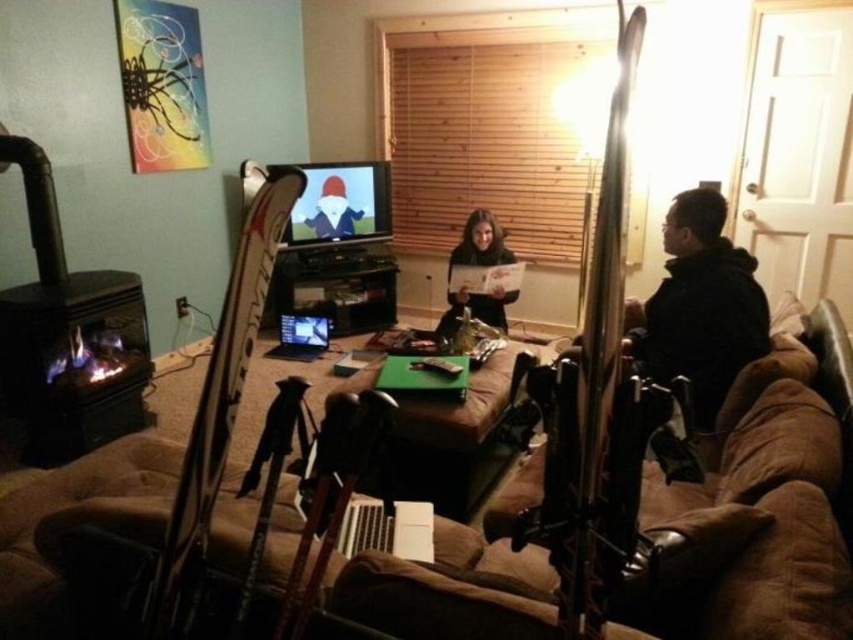
Who is lower down, brown fabric couch at center or dark brown hair at center?

brown fabric couch at center is below.

Can you confirm if brown fabric couch at center is positioned to the right of dark brown hair at center?

Indeed, brown fabric couch at center is positioned on the right side of dark brown hair at center.

The height and width of the screenshot is (640, 853). What do you see at coordinates (750, 522) in the screenshot?
I see `brown fabric couch at center` at bounding box center [750, 522].

At what (x,y) coordinates should I click in order to perform the action: click on brown fabric couch at center. Please return your answer as a coordinate pair (x, y). This screenshot has height=640, width=853. Looking at the image, I should click on (750, 522).

Can you confirm if brown fabric couch at center is positioned above silver metallic laptop at center?

Actually, brown fabric couch at center is below silver metallic laptop at center.

Is brown fabric couch at center shorter than silver metallic laptop at center?

In fact, brown fabric couch at center may be taller than silver metallic laptop at center.

Who is more forward, (x=668, y=493) or (x=317, y=339)?

Positioned in front is point (x=668, y=493).

You are a GUI agent. You are given a task and a screenshot of the screen. Output one action in this format:
    pyautogui.click(x=<x>, y=<y>)
    Task: Click on the brown fabric couch at center
    This screenshot has height=640, width=853.
    Given the screenshot: What is the action you would take?
    pyautogui.click(x=750, y=522)

Is dark brown hair at center bigger than silver metallic laptop at center?

Yes.

Is dark brown hair at center thinner than silver metallic laptop at center?

No, dark brown hair at center is not thinner than silver metallic laptop at center.

This screenshot has height=640, width=853. Describe the element at coordinates (480, 243) in the screenshot. I see `dark brown hair at center` at that location.

Image resolution: width=853 pixels, height=640 pixels. In order to click on dark brown hair at center in this screenshot , I will do `click(480, 243)`.